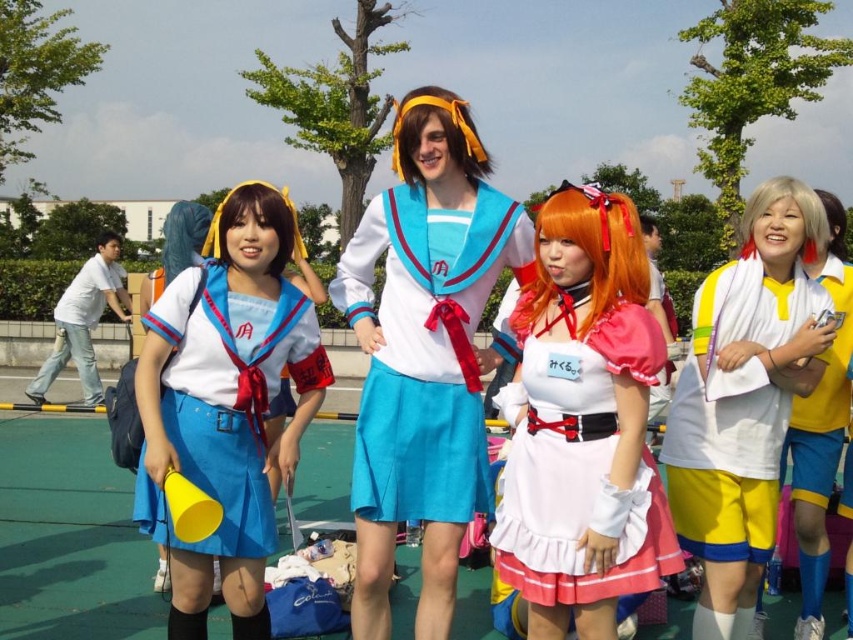
Who is higher up, satin blue skirt at center or white matte wig at right?

white matte wig at right is higher up.

Is point (438, 602) less distant than point (772, 202)?

Yes, it is.

At what (x,y) coordinates should I click in order to perform the action: click on satin blue skirt at center. Please return your answer as a coordinate pair (x, y). Looking at the image, I should click on (424, 353).

Does point (68, 353) come closer to viewer compared to point (215, 243)?

No.

Does matte blue skirt at lower left have a lesser width compared to yellow fabric wig at upper left?

Yes.

The image size is (853, 640). Describe the element at coordinates (83, 321) in the screenshot. I see `matte blue skirt at lower left` at that location.

Where is `matte blue skirt at lower left`? matte blue skirt at lower left is located at coordinates (83, 321).

Which is above, yellow fabric shorts at right or matte blue skirt at lower left?

matte blue skirt at lower left is higher up.

Is yellow fabric shorts at right in front of matte blue skirt at lower left?

Yes, yellow fabric shorts at right is closer to the viewer.

Is point (796, 332) positioned in front of point (100, 268)?

Yes, it is in front of point (100, 268).

Locate an element on the screen. yellow fabric shorts at right is located at coordinates (746, 397).